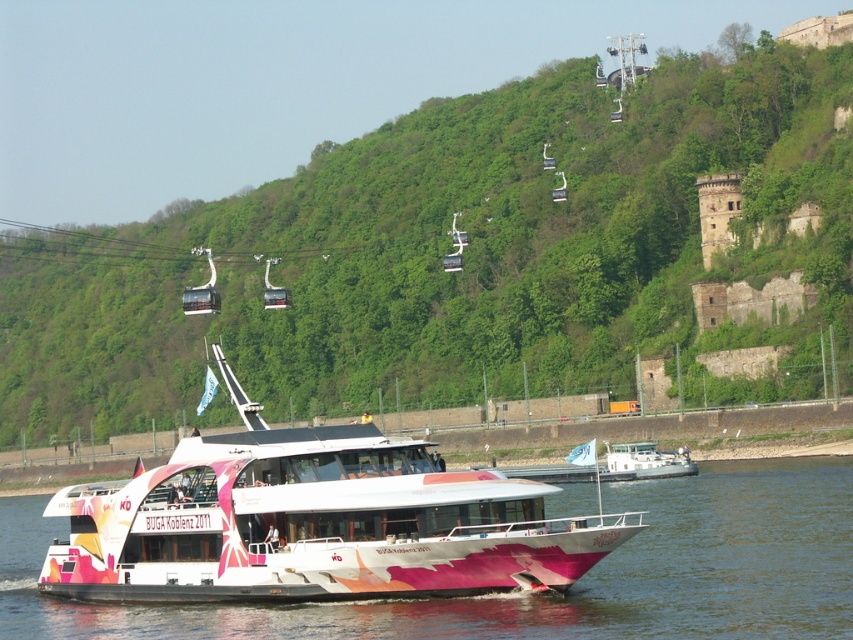
Looking at this image, between green leafy hillside at upper center and pink glossy boat at lower center, which one is positioned lower?

pink glossy boat at lower center is lower down.

Describe the element at coordinates (450, 250) in the screenshot. The image size is (853, 640). I see `green leafy hillside at upper center` at that location.

This screenshot has width=853, height=640. What are the coordinates of `green leafy hillside at upper center` in the screenshot? It's located at (450, 250).

How much distance is there between white glossy boat at center and pink glossy boat at lower center?

white glossy boat at center is 7.02 meters away from pink glossy boat at lower center.

Does white glossy boat at center have a larger size compared to pink glossy boat at lower center?

Incorrect, white glossy boat at center is not larger than pink glossy boat at lower center.

Which is in front, point (379, 524) or point (529, 611)?

Point (529, 611) is in front.

Locate an element on the screen. Image resolution: width=853 pixels, height=640 pixels. white glossy boat at center is located at coordinates (312, 522).

In the scene shown: Is the position of green leafy hillside at upper center less distant than that of white glossy boat at center?

No, it is not.

Can you confirm if green leafy hillside at upper center is positioned to the left of white glossy boat at center?

Correct, you'll find green leafy hillside at upper center to the left of white glossy boat at center.

Describe the element at coordinates (450, 250) in the screenshot. I see `green leafy hillside at upper center` at that location.

This screenshot has width=853, height=640. Identify the location of green leafy hillside at upper center. (450, 250).